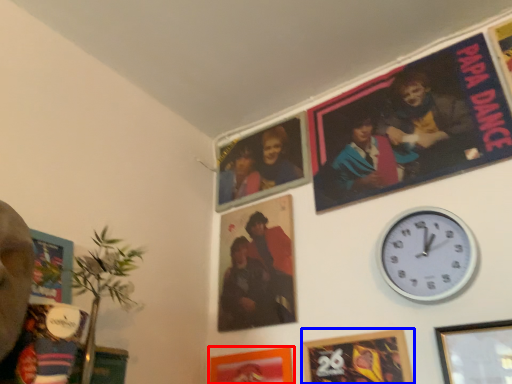
Question: Which of the following is the closest to the observer, picture frame (highlighted by a red box) or picture frame (highlighted by a blue box)?

Choices:
 (A) picture frame
 (B) picture frame

Answer: (B)